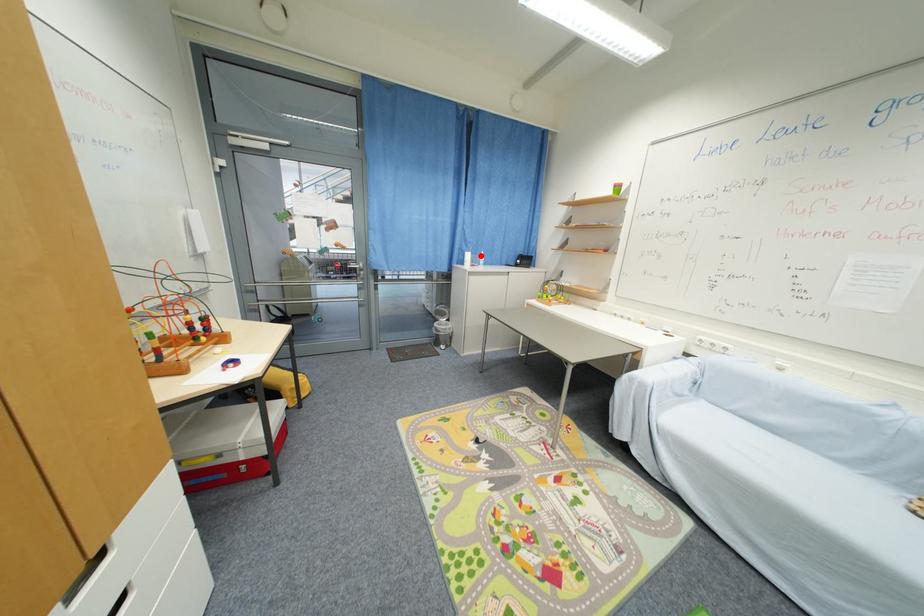
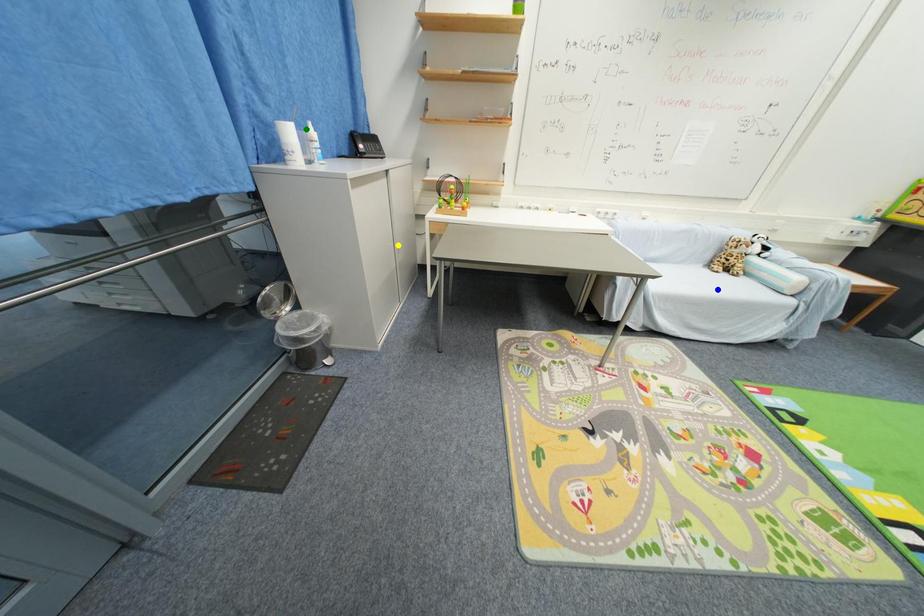
Question: I am providing you with two images of the same scene from different viewpoints. A red point is marked on the first image. You are given multiple points on the second image. In image 2, which mark is for the same physical point as the one in image 1?

Choices:
 (A) yellow point
 (B) blue point
 (C) green point

Answer: (C)